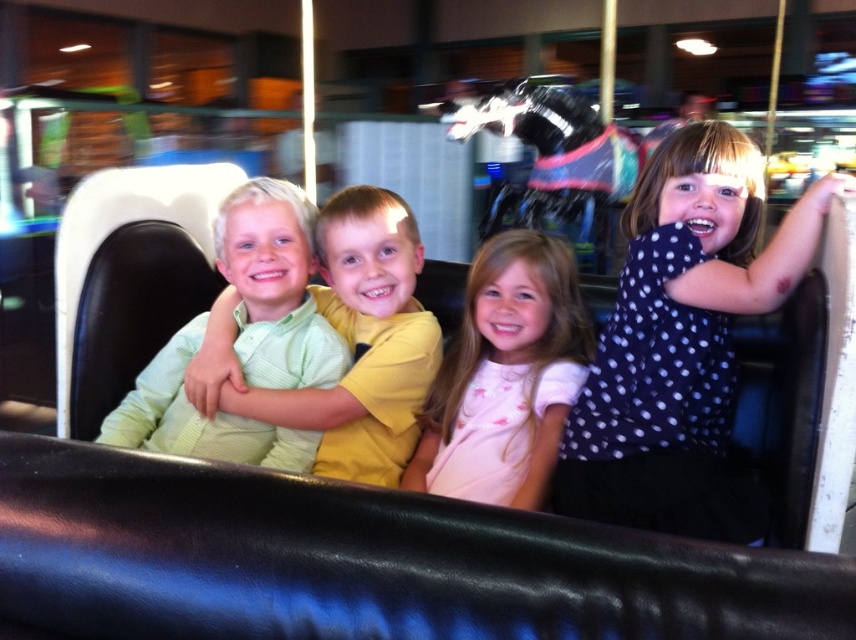
Can you confirm if polka dot blouse at upper right is bigger than pink cotton shirt at center?

Correct, polka dot blouse at upper right is larger in size than pink cotton shirt at center.

Is point (590, 385) closer to camera compared to point (507, 372)?

Yes, point (590, 385) is closer to viewer.

In order to click on polka dot blouse at upper right in this screenshot , I will do `click(682, 340)`.

Image resolution: width=856 pixels, height=640 pixels. I want to click on polka dot blouse at upper right, so click(682, 340).

Is green textured shirt at center shorter than pink cotton shirt at center?

Incorrect, green textured shirt at center's height does not fall short of pink cotton shirt at center's.

What do you see at coordinates (348, 342) in the screenshot? I see `green textured shirt at center` at bounding box center [348, 342].

This screenshot has height=640, width=856. In order to click on green textured shirt at center in this screenshot , I will do `click(348, 342)`.

Is the position of pink cotton shirt at center more distant than that of light green knitted sweater at center?

No, pink cotton shirt at center is closer to the viewer.

Between pink cotton shirt at center and light green knitted sweater at center, which one has less height?

With less height is pink cotton shirt at center.

The image size is (856, 640). What are the coordinates of `pink cotton shirt at center` in the screenshot? It's located at (504, 376).